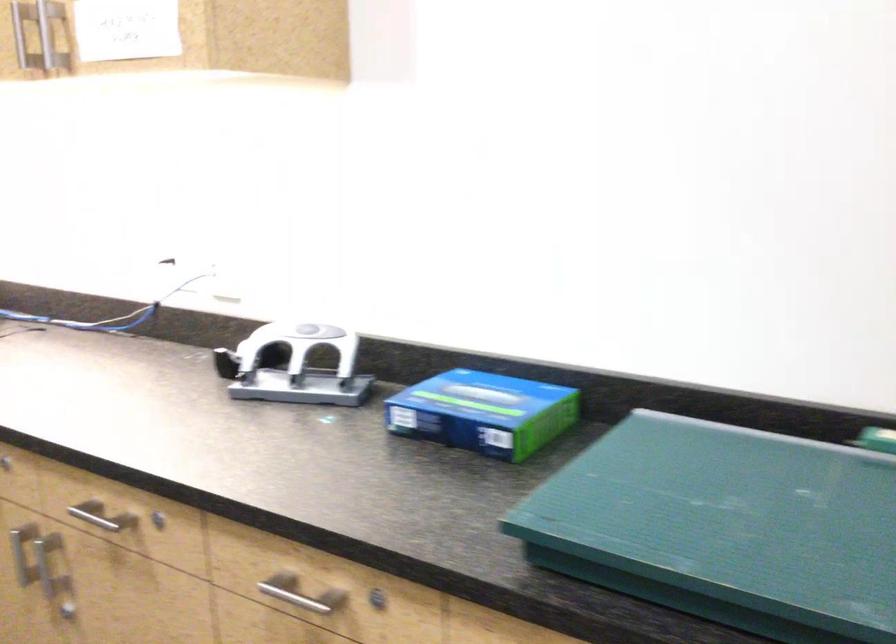
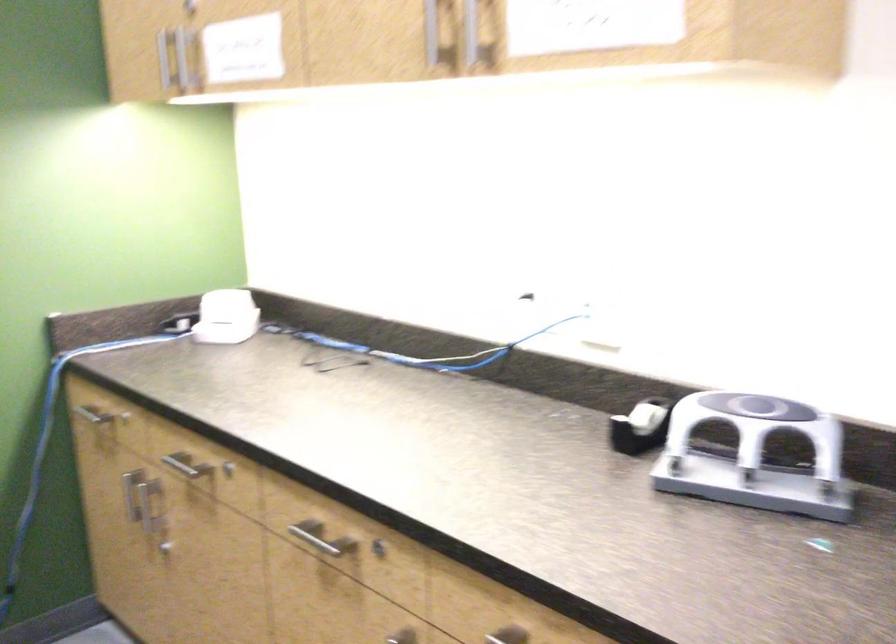
Where in the second image is the point corresponding to point 250,357 from the first image?

(641, 427)